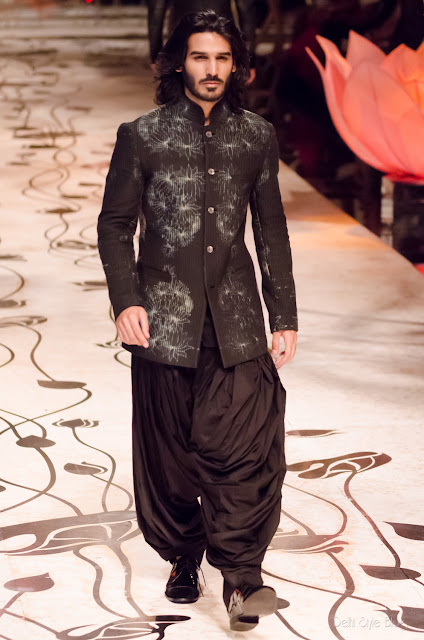
Locate an element on the screen. floor is located at coordinates (63, 573).